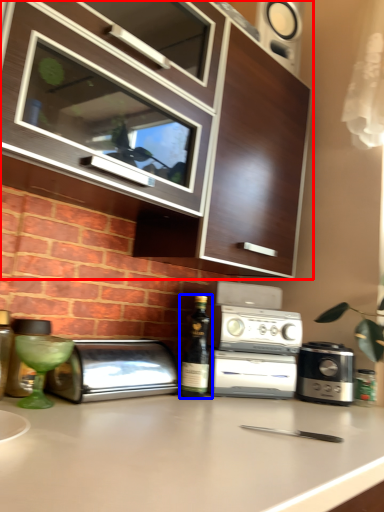
Question: Which point is closer to the camera, cabinetry (highlighted by a red box) or wine bottle (highlighted by a blue box)?

Choices:
 (A) cabinetry
 (B) wine bottle

Answer: (A)